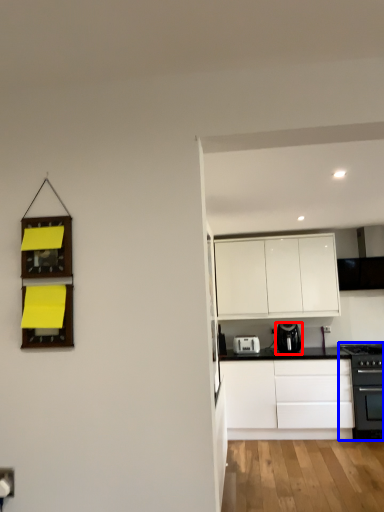
Question: Which object appears farthest to the camera in this image, kitchen appliance (highlighted by a red box) or home appliance (highlighted by a blue box)?

Choices:
 (A) kitchen appliance
 (B) home appliance

Answer: (A)